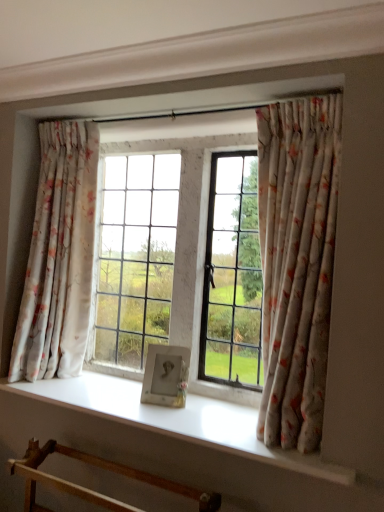
Question: Looking at the image, does white smooth window sill at center seem bigger or smaller compared to floral fabric curtain at right, marked as the first curtain in a right-to-left arrangement?

Choices:
 (A) small
 (B) big

Answer: (A)

Question: Visually, is white smooth window sill at center positioned to the left or to the right of floral fabric curtain at right, which ranks as the 2th curtain in left-to-right order?

Choices:
 (A) right
 (B) left

Answer: (B)

Question: Estimate the real-world distances between objects in this image. Which object is farther from the floral fabric curtain at right, which appears as the second curtain when viewed from the back?

Choices:
 (A) white smooth window sill at center
 (B) wooden frame at lower left
 (C) floral fabric curtain at left, which appears as the second curtain when viewed from the right

Answer: (C)

Question: Which of these objects is positioned farthest from the white smooth window sill at center?

Choices:
 (A) floral fabric curtain at right, which appears as the second curtain when viewed from the back
 (B) wooden frame at lower left
 (C) floral fabric curtain at left, which appears as the second curtain when viewed from the right

Answer: (C)